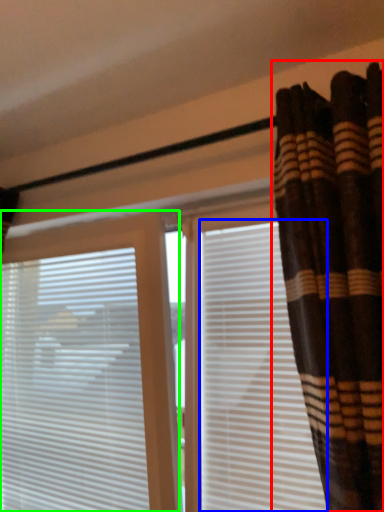
Question: Which object is positioned farthest from curtain (highlighted by a red box)? Select from shutter (highlighted by a blue box) and window blind (highlighted by a green box).

Choices:
 (A) shutter
 (B) window blind

Answer: (B)